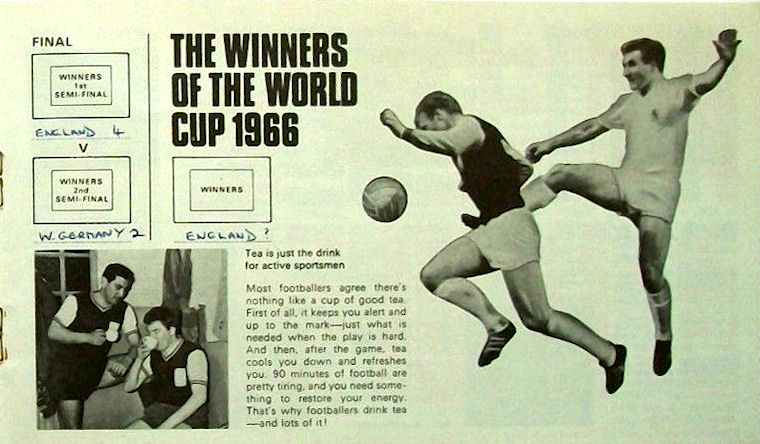
At what (x,y) coordinates should I click in order to perform the action: click on teacups. Please return your answer as a coordinate pair (x, y). Looking at the image, I should click on (108, 332), (152, 343).